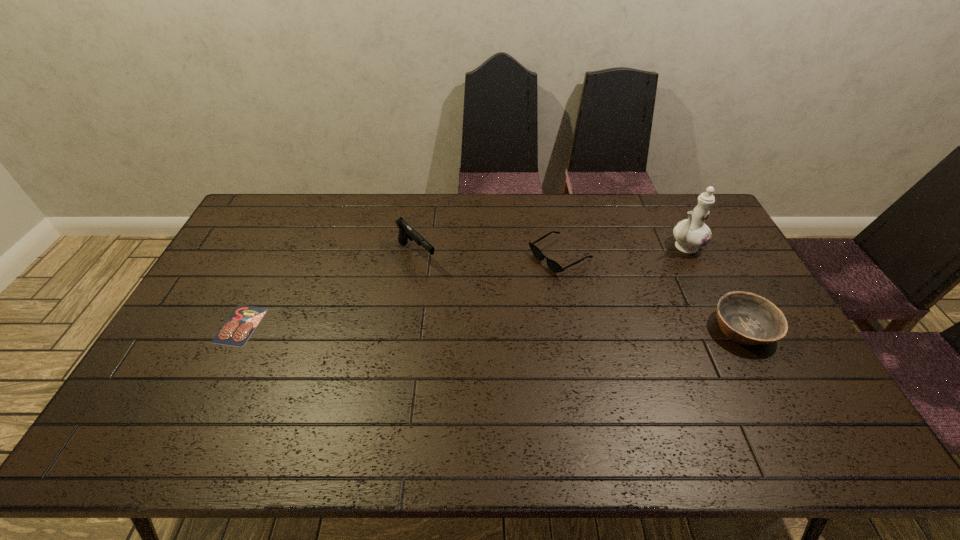
Where is `vacant area located at the spout of the chinaware`? vacant area located at the spout of the chinaware is located at coordinates (660, 262).

The image size is (960, 540). What are the coordinates of `free space located at the spout of the chinaware` in the screenshot? It's located at (618, 290).

What are the coordinates of `vacant space located 0.190m at the spout of the chinaware` in the screenshot? It's located at (636, 278).

You are a GUI agent. You are given a task and a screenshot of the screen. Output one action in this format:
    pyautogui.click(x=<x>, y=<y>)
    Task: Click on the free space located at the aiming end of the fourth shortest object
    This screenshot has width=960, height=540.
    Given the screenshot: What is the action you would take?
    pyautogui.click(x=460, y=301)

Find the location of `vacant area situated at the aiming end of the fourth shortest object`. vacant area situated at the aiming end of the fourth shortest object is located at coordinates (452, 293).

Where is `blank space located 0.310m at the aiming end of the fourth shortest object`? blank space located 0.310m at the aiming end of the fourth shortest object is located at coordinates (489, 329).

I want to click on free region located on the front-facing side of the second shortest object, so click(500, 289).

This screenshot has width=960, height=540. I want to click on vacant space positioned on the front-facing side of the second shortest object, so click(x=452, y=316).

Identify the location of vacant space located 0.110m on the front-facing side of the second shortest object. The image size is (960, 540). (511, 284).

Locate an element on the screen. The width and height of the screenshot is (960, 540). object that is at the left edge is located at coordinates coord(237,329).